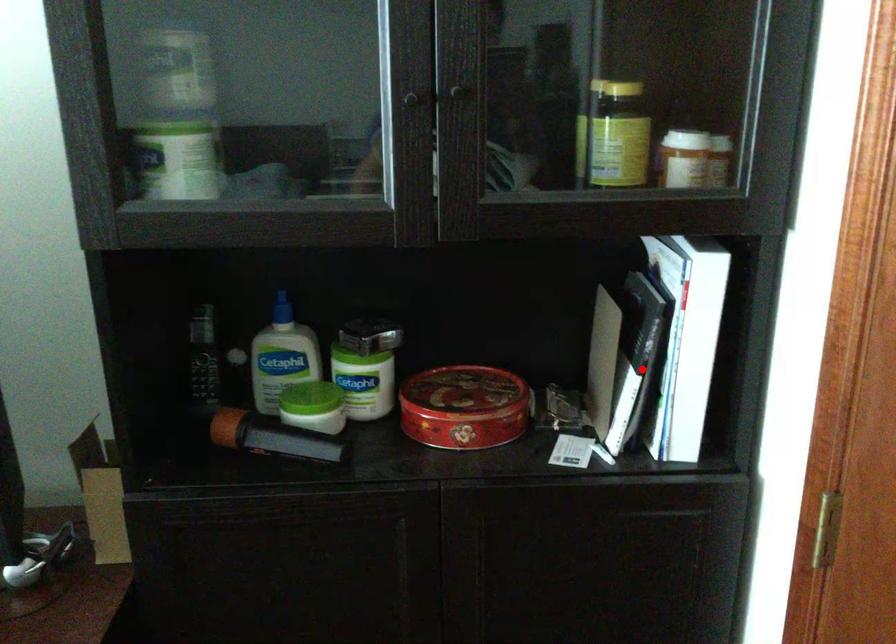
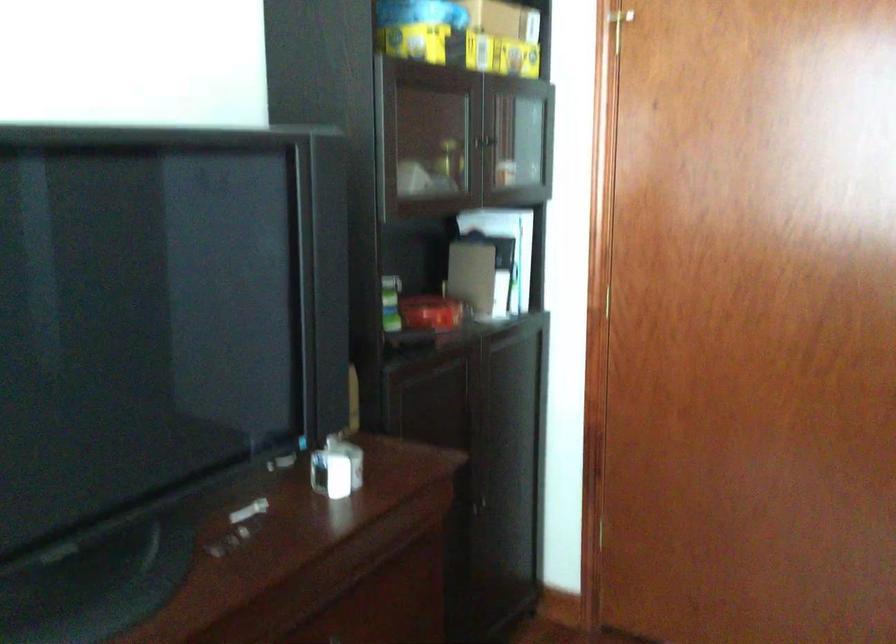
Question: I am providing you with two images of the same scene from different viewpoints. Image1 has a red point marked. In image2, the corresponding 3D location appears at what relative position? Reply with the corresponding letter.

Choices:
 (A) Closer
 (B) Farther

Answer: (B)